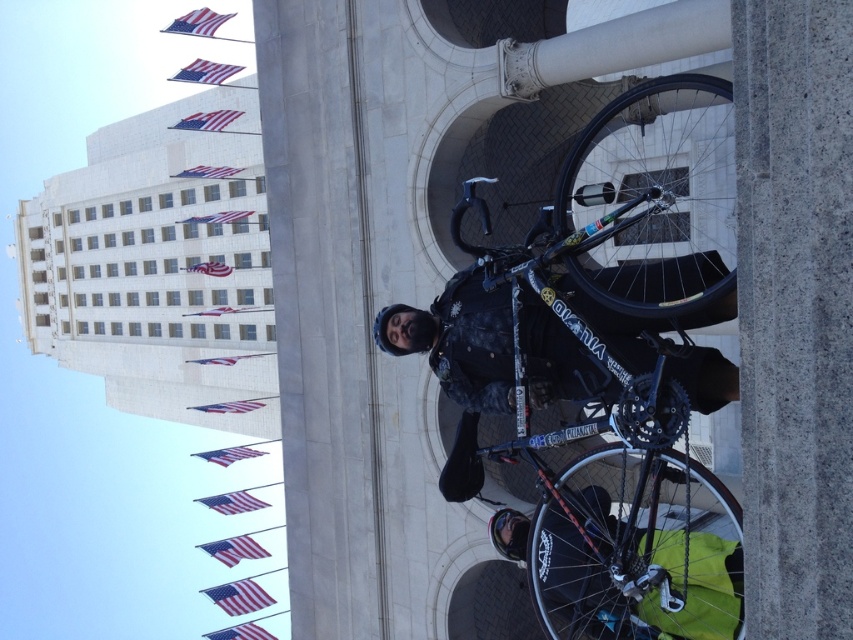
You are a photographer trying to capture the shiny black bicycle at center in your shot. The camera is positioned at the point with coordinates (634, 372). Where should you aim your camera to include the shiny black bicycle at center in the frame?

The point at coordinates (634, 372) marks the shiny black bicycle at center, so aiming the camera at that point will ensure the shiny black bicycle at center is centered in the frame.

You are a photographer trying to capture the shiny black tire at center and the dark blue fabric jacket at center in the same frame. Based on their sizes, which object should you focus on first to ensure both are in focus?

The shiny black tire at center has a greater height compared to dark blue fabric jacket at center, so you should focus on the shiny black tire at center first to ensure both are in focus since it is larger and requires more attention in the frame.